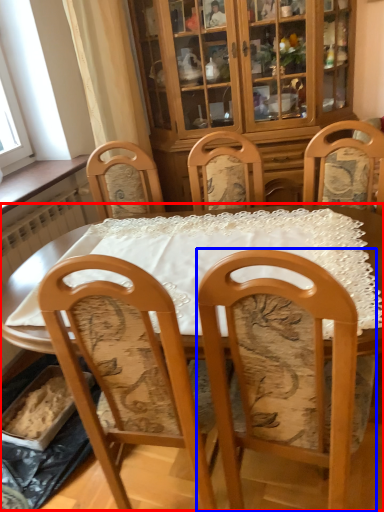
Question: Which object is further to the camera taking this photo, table (highlighted by a red box) or chair (highlighted by a blue box)?

Choices:
 (A) table
 (B) chair

Answer: (A)